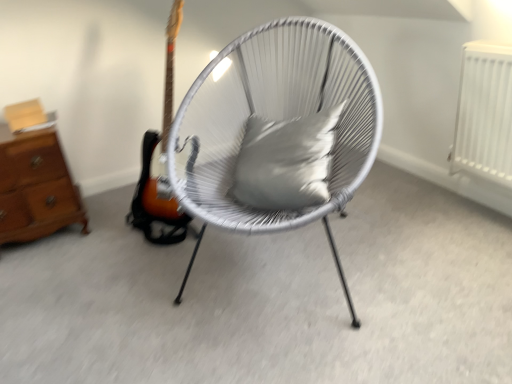
Question: Is brown wooden chest of drawers at left situated inside satin gray pillow at center or outside?

Choices:
 (A) outside
 (B) inside

Answer: (A)

Question: From their relative heights in the image, would you say brown wooden chest of drawers at left is taller or shorter than satin gray pillow at center?

Choices:
 (A) short
 (B) tall

Answer: (B)

Question: Which object is positioned farthest from the white woven chair at center?

Choices:
 (A) brown wooden chest of drawers at left
 (B) satin gray pillow at center

Answer: (A)

Question: Which of these objects is positioned closest to the satin gray pillow at center?

Choices:
 (A) brown wooden chest of drawers at left
 (B) white woven chair at center

Answer: (B)